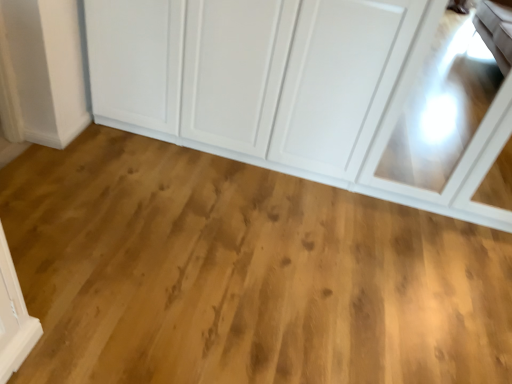
Identify the location of white glossy cupboard at upper center. (283, 87).

What do you see at coordinates (283, 87) in the screenshot?
I see `white glossy cupboard at upper center` at bounding box center [283, 87].

What is the approximate width of white glossy cupboard at upper center?

The width of white glossy cupboard at upper center is 25.92 inches.

The height and width of the screenshot is (384, 512). Describe the element at coordinates (243, 274) in the screenshot. I see `natural wood floor at center` at that location.

Find the location of a particular element. This screenshot has width=512, height=384. natural wood floor at center is located at coordinates (243, 274).

Locate an element on the screen. The width and height of the screenshot is (512, 384). white glossy cupboard at upper center is located at coordinates (283, 87).

Does white glossy cupboard at upper center appear on the left side of natural wood floor at center?

No, white glossy cupboard at upper center is not to the left of natural wood floor at center.

Consider the image. In the image, is white glossy cupboard at upper center positioned in front of or behind natural wood floor at center?

white glossy cupboard at upper center is positioned farther from the viewer than natural wood floor at center.

Which is more distant, (312,99) or (234,371)?

The point (312,99) is more distant.

From the image's perspective, which is below, white glossy cupboard at upper center or natural wood floor at center?

natural wood floor at center, from the image's perspective.

From a real-world perspective, is white glossy cupboard at upper center above or below natural wood floor at center?

Clearly, from a real-world perspective, white glossy cupboard at upper center is above natural wood floor at center.

Considering the relative sizes of white glossy cupboard at upper center and natural wood floor at center in the image provided, is white glossy cupboard at upper center wider than natural wood floor at center?

No.

Who is taller, white glossy cupboard at upper center or natural wood floor at center?

white glossy cupboard at upper center is taller.

Can you confirm if white glossy cupboard at upper center is smaller than natural wood floor at center?

No.

Looking at this image, would you say white glossy cupboard at upper center is inside or outside natural wood floor at center?

white glossy cupboard at upper center exists outside the volume of natural wood floor at center.

Based on the photo, does white glossy cupboard at upper center touch natural wood floor at center?

No, white glossy cupboard at upper center is not beside natural wood floor at center.

Is white glossy cupboard at upper center oriented towards natural wood floor at center?

Yes, white glossy cupboard at upper center is facing natural wood floor at center.

Measure the distance from white glossy cupboard at upper center to natural wood floor at center.

white glossy cupboard at upper center and natural wood floor at center are 54.29 centimeters apart from each other.

Locate an element on the screen. The height and width of the screenshot is (384, 512). cupboard to the right of natural wood floor at center is located at coordinates (283, 87).

Considering the positions of objects natural wood floor at center and white glossy cupboard at upper center in the image provided, who is more to the left, natural wood floor at center or white glossy cupboard at upper center?

natural wood floor at center is more to the left.

Based on the photo, relative to white glossy cupboard at upper center, is natural wood floor at center in front or behind?

In the image, natural wood floor at center appears in front of white glossy cupboard at upper center.

Is point (205, 227) positioned in front of point (234, 85)?

That is True.

From the image's perspective, which one is positioned lower, natural wood floor at center or white glossy cupboard at upper center?

From the image's view, natural wood floor at center is below.

From a real-world perspective, is natural wood floor at center on top of white glossy cupboard at upper center?

Incorrect, from a real-world perspective, natural wood floor at center is lower than white glossy cupboard at upper center.

Is natural wood floor at center wider than white glossy cupboard at upper center?

Yes.

Considering the sizes of objects natural wood floor at center and white glossy cupboard at upper center in the image provided, who is taller, natural wood floor at center or white glossy cupboard at upper center?

white glossy cupboard at upper center.

Based on their sizes in the image, would you say natural wood floor at center is bigger or smaller than white glossy cupboard at upper center?

Clearly, natural wood floor at center is smaller in size than white glossy cupboard at upper center.

Which is correct: natural wood floor at center is inside white glossy cupboard at upper center, or outside of it?

natural wood floor at center exists outside the volume of white glossy cupboard at upper center.

Is the surface of natural wood floor at center in direct contact with white glossy cupboard at upper center?

No, natural wood floor at center is not in contact with white glossy cupboard at upper center.

Could you tell me if natural wood floor at center is facing white glossy cupboard at upper center?

No, natural wood floor at center does not turn towards white glossy cupboard at upper center.

I want to click on cupboard positioned vertically above the natural wood floor at center (from a real-world perspective), so click(x=283, y=87).

Where is `plain located on the left of white glossy cupboard at upper center`? The width and height of the screenshot is (512, 384). plain located on the left of white glossy cupboard at upper center is located at coordinates click(x=243, y=274).

Find the location of `plain in front of the white glossy cupboard at upper center`. plain in front of the white glossy cupboard at upper center is located at coordinates (243, 274).